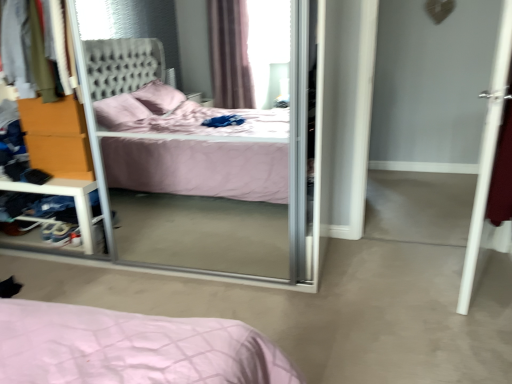
Find the location of a particular element. empty space that is ontop of clear plastic shelf at left (from a real-world perspective) is located at coordinates (33, 179).